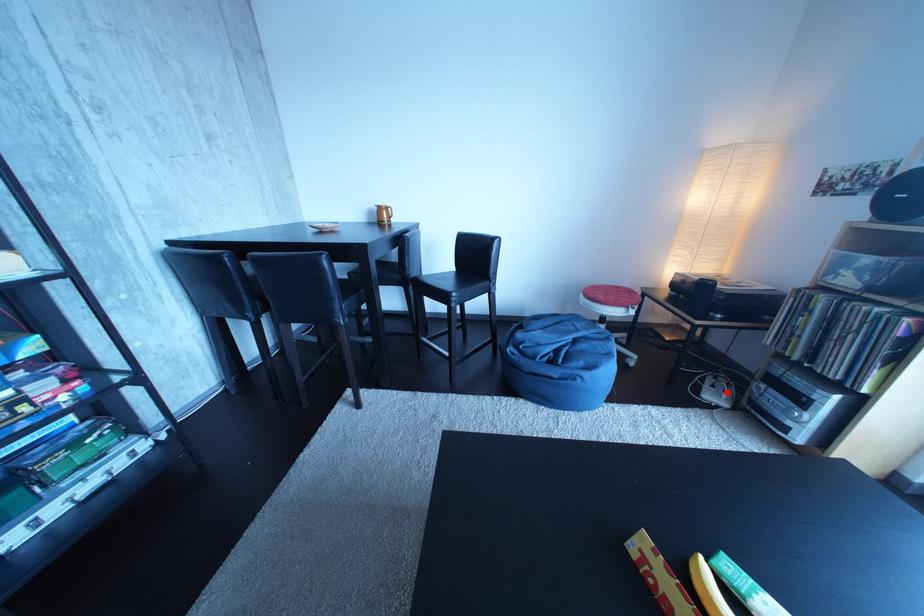
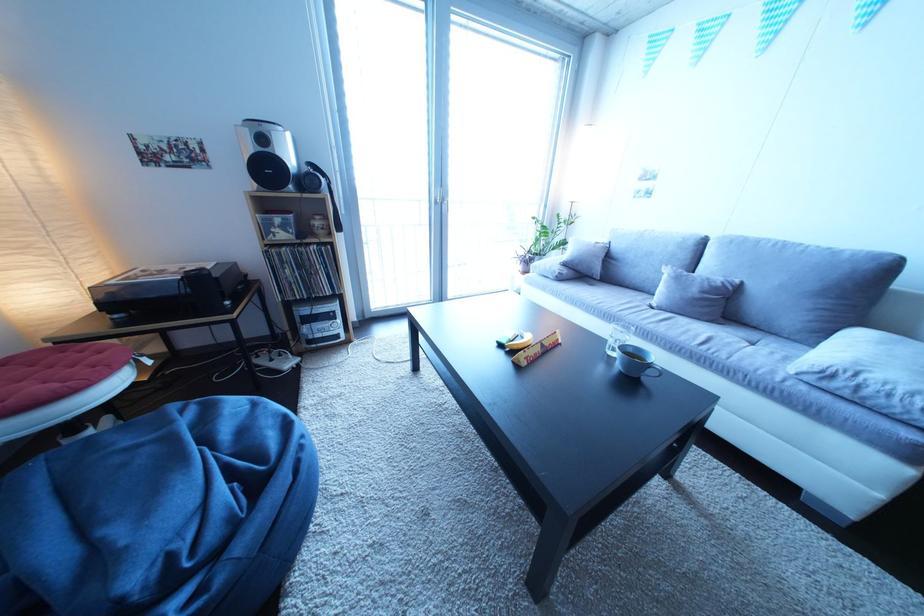
Question: I am providing you with two images of the same scene from different viewpoints. Image1 has a red point marked. In image2, the corresponding 3D location appears at what relative position? Reply with the corresponding letter.

Choices:
 (A) Closer
 (B) Farther

Answer: (B)